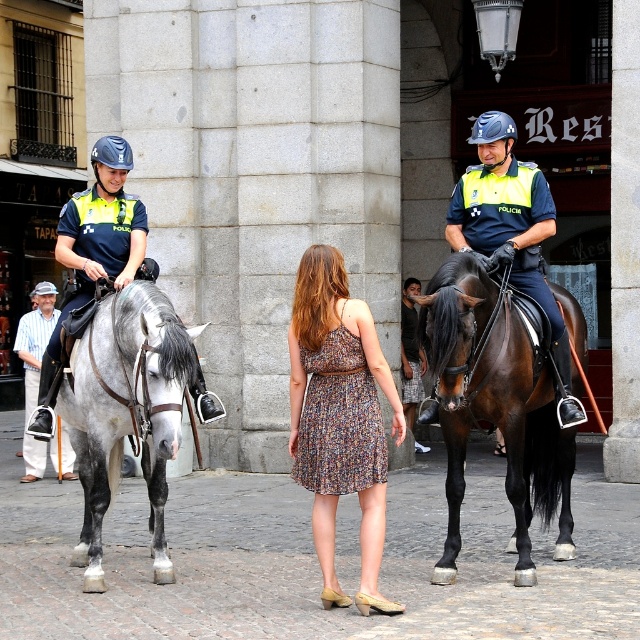
Can you confirm if brown glossy horse at center is positioned below gray glossy horse at left?

Incorrect, brown glossy horse at center is not positioned below gray glossy horse at left.

Can you confirm if brown glossy horse at center is shorter than gray glossy horse at left?

No.

This screenshot has height=640, width=640. Describe the element at coordinates (493, 406) in the screenshot. I see `brown glossy horse at center` at that location.

Find the location of a particular element. The image size is (640, 640). brown glossy horse at center is located at coordinates (493, 406).

Between brown glossy horse at center and floral dress at center, which one is positioned higher?

floral dress at center is above.

Is point (440, 276) positioned in front of point (292, 380)?

That is False.

This screenshot has height=640, width=640. Find the location of `brown glossy horse at center`. brown glossy horse at center is located at coordinates (493, 406).

Can you confirm if brown glossy horse at center is smaller than striped cotton shirt at left?

Actually, brown glossy horse at center might be larger than striped cotton shirt at left.

Which of these two, brown glossy horse at center or striped cotton shirt at left, stands taller?

brown glossy horse at center is taller.

This screenshot has height=640, width=640. What do you see at coordinates (493, 406) in the screenshot?
I see `brown glossy horse at center` at bounding box center [493, 406].

This screenshot has width=640, height=640. I want to click on brown glossy horse at center, so click(493, 406).